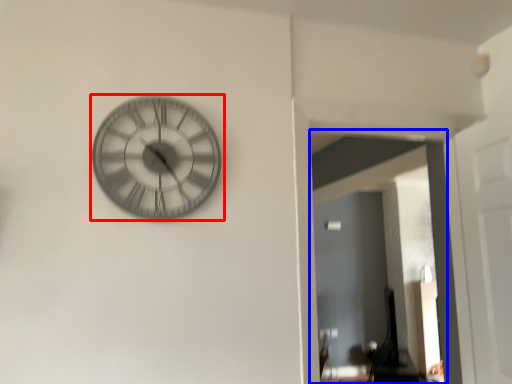
Question: Which point is further to the camera, wall clock (highlighted by a red box) or glass door (highlighted by a blue box)?

Choices:
 (A) wall clock
 (B) glass door

Answer: (B)